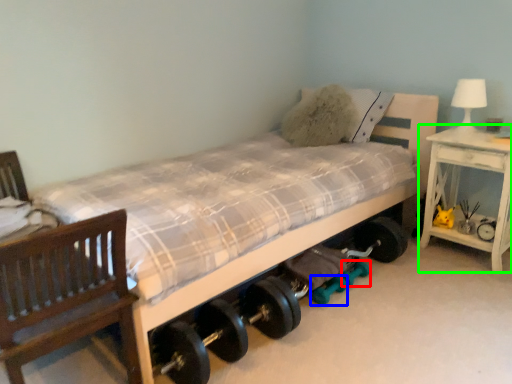
Question: Estimate the real-world distances between objects in this image. Which object is farther from dumbbell (highlighted by a red box), dumbbell (highlighted by a blue box) or nightstand (highlighted by a green box)?

Choices:
 (A) dumbbell
 (B) nightstand

Answer: (B)